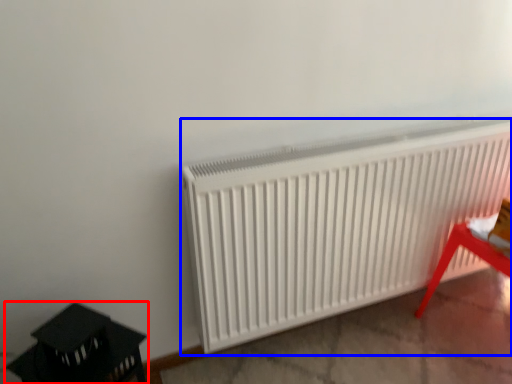
Question: Which object appears closest to the camera in this image, furniture (highlighted by a red box) or radiator (highlighted by a blue box)?

Choices:
 (A) furniture
 (B) radiator

Answer: (A)